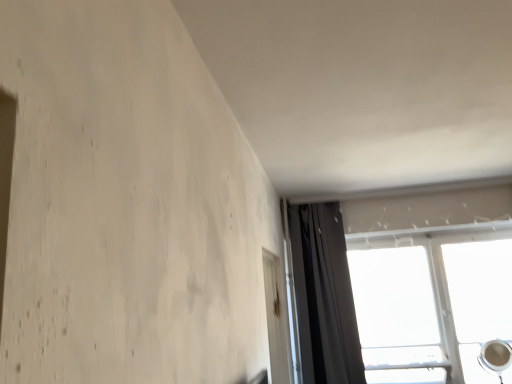
Question: In the image, is transparent glass window at upper right on the left side or the right side of transparent plastic screen door at lower right?

Choices:
 (A) left
 (B) right

Answer: (B)

Question: Considering the positions of transparent glass window at upper right and transparent plastic screen door at lower right in the image, is transparent glass window at upper right taller or shorter than transparent plastic screen door at lower right?

Choices:
 (A) short
 (B) tall

Answer: (B)

Question: Which is farther from the transparent glass window at upper right?

Choices:
 (A) dark gray fabric curtain at upper right
 (B) transparent plastic screen door at lower right

Answer: (B)

Question: Considering the real-world distances, which object is closest to the transparent glass window at upper right?

Choices:
 (A) transparent plastic screen door at lower right
 (B) dark gray fabric curtain at upper right

Answer: (B)